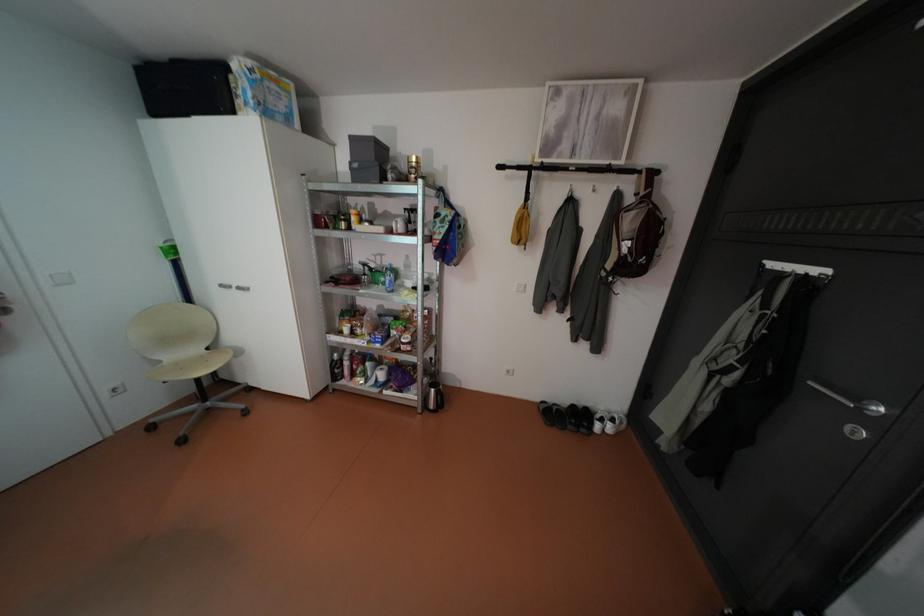
Find where to lift the metal kettle handle. Please return your answer as a coordinate pair (x, y).

(440, 398)